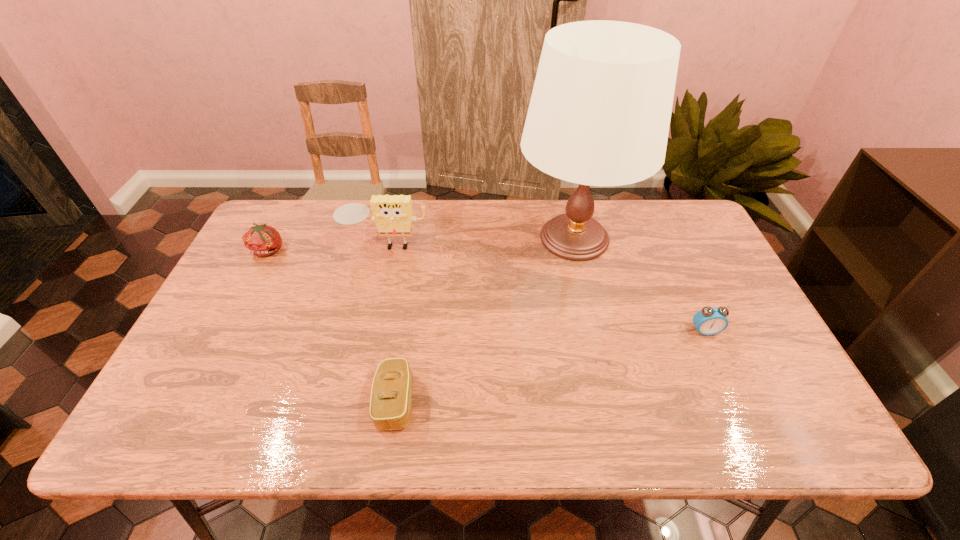
You are a GUI agent. You are given a task and a screenshot of the screen. Output one action in this format:
    pyautogui.click(x=<x>, y=<y>)
    Task: Click on the fourth object from left to right
    
    Given the screenshot: What is the action you would take?
    pyautogui.click(x=599, y=114)

Identify the location of lamp. (599, 114).

I want to click on the fourth shortest object, so click(x=393, y=214).

This screenshot has height=540, width=960. In order to click on tomato in this screenshot , I will do `click(261, 240)`.

You are a GUI agent. You are given a task and a screenshot of the screen. Output one action in this format:
    pyautogui.click(x=<x>, y=<y>)
    Task: Click on the alarm clock
    Image resolution: width=960 pixels, height=540 pixels.
    Given the screenshot: What is the action you would take?
    pyautogui.click(x=710, y=320)

Find the location of a particular element. the fourth farthest object is located at coordinates (710, 320).

The image size is (960, 540). I want to click on clutch bag, so click(391, 396).

You are a GUI agent. You are given a task and a screenshot of the screen. Output one action in this format:
    pyautogui.click(x=<x>, y=<y>)
    Task: Click on the free space located 0.170m on the left of the second object from right to left
    This screenshot has width=960, height=540.
    Given the screenshot: What is the action you would take?
    pyautogui.click(x=461, y=238)

Where is `free location located 0.350m on the front-facing side of the second tallest object`? This screenshot has width=960, height=540. free location located 0.350m on the front-facing side of the second tallest object is located at coordinates (361, 351).

Locate an element on the screen. vacant point located on the front of the tomato is located at coordinates (255, 276).